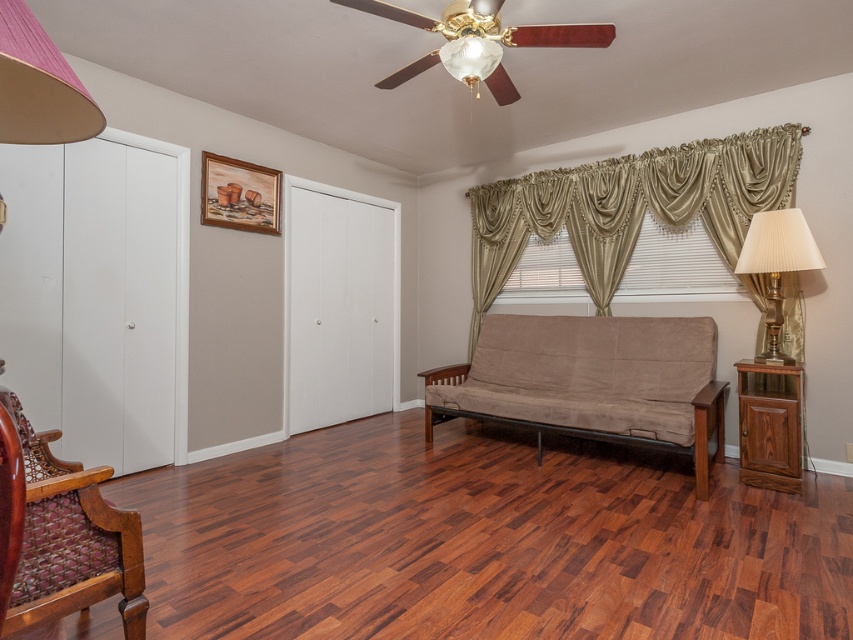
Question: Can you confirm if wooden woven armchair at lower left is positioned above walnut wood cabinet at right?

Choices:
 (A) yes
 (B) no

Answer: (B)

Question: Where is wooden woven armchair at lower left located in relation to walnut wood cabinet at right in the image?

Choices:
 (A) right
 (B) left

Answer: (B)

Question: Which point is farther to the camera?

Choices:
 (A) walnut wood cabinet at right
 (B) wooden woven armchair at lower left

Answer: (A)

Question: Is satin/golden drapes at upper right positioned in front of wooden woven armchair at lower left?

Choices:
 (A) no
 (B) yes

Answer: (A)

Question: Which point is farther from the camera taking this photo?

Choices:
 (A) (494, 198)
 (B) (538, 444)
 (C) (766, 214)
 (D) (790, 384)

Answer: (A)

Question: Which of the following is the farthest from the observer?

Choices:
 (A) suede-like brown futon at center
 (B) satin/golden drapes at upper right
 (C) wooden woven armchair at lower left

Answer: (B)